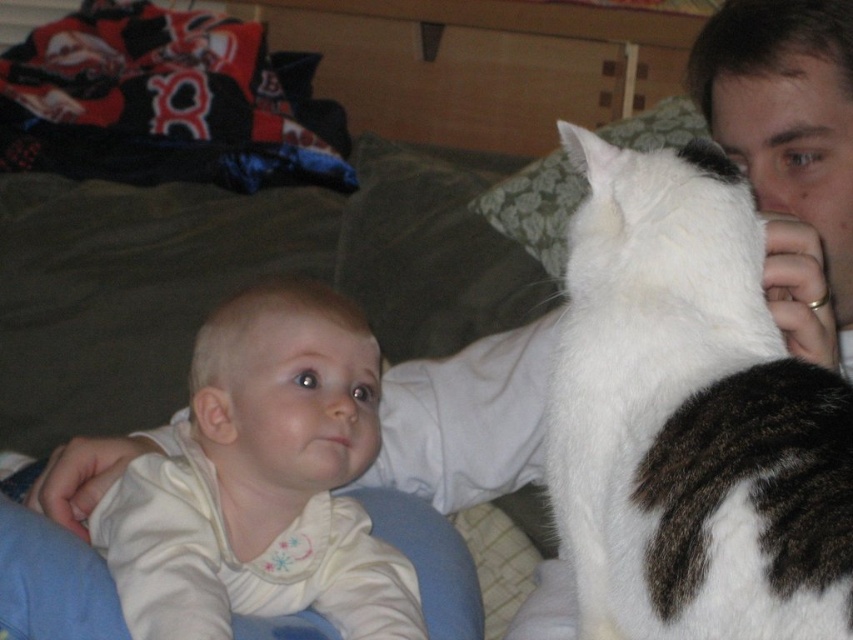
Question: Which object appears farthest from the camera in this image?

Choices:
 (A) white soft baby at center
 (B) white soft fur cat at upper right

Answer: (A)

Question: Is white soft fur cat at upper right closer to the viewer compared to white soft baby at center?

Choices:
 (A) no
 (B) yes

Answer: (B)

Question: Can you confirm if white soft fur cat at upper right is positioned to the right of white soft baby at center?

Choices:
 (A) no
 (B) yes

Answer: (B)

Question: Among these objects, which one is nearest to the camera?

Choices:
 (A) white soft fur cat at upper right
 (B) white soft baby at center

Answer: (A)

Question: Does white soft fur cat at upper right have a greater width compared to white soft baby at center?

Choices:
 (A) no
 (B) yes

Answer: (A)

Question: Which point is farther to the camera?

Choices:
 (A) (332, 448)
 (B) (743, 189)

Answer: (A)